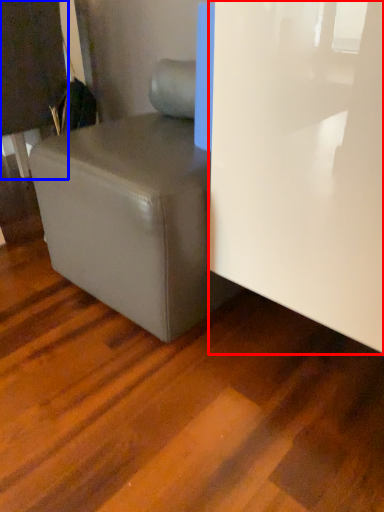
Question: Which object is closer to the camera taking this photo, glass door (highlighted by a red box) or furniture (highlighted by a blue box)?

Choices:
 (A) glass door
 (B) furniture

Answer: (A)